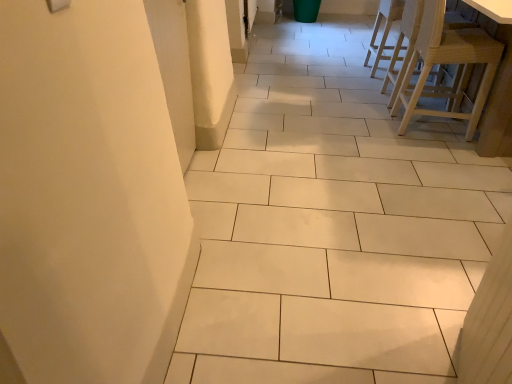
Question: Should I look upward or downward to see light wood stool at right, positioned as the third chair in back-to-front order?

Choices:
 (A) down
 (B) up

Answer: (B)

Question: Considering the relative sizes of natural wood chair at upper right, the 2th chair when ordered from back to front, and light wood stool at right, positioned as the third chair in back-to-front order, in the image provided, is natural wood chair at upper right, the 2th chair when ordered from back to front, wider than light wood stool at right, positioned as the third chair in back-to-front order,?

Choices:
 (A) no
 (B) yes

Answer: (B)

Question: Would you say natural wood chair at upper right, acting as the second chair starting from the front, contains light wood stool at right, which is the 1th chair from front to back?

Choices:
 (A) no
 (B) yes

Answer: (A)

Question: From the image's perspective, is natural wood chair at upper right, acting as the second chair starting from the front, below light wood stool at right, positioned as the third chair in back-to-front order?

Choices:
 (A) no
 (B) yes

Answer: (A)

Question: Does natural wood chair at upper right, the 2th chair when ordered from back to front, come in front of light wood stool at right, positioned as the third chair in back-to-front order?

Choices:
 (A) yes
 (B) no

Answer: (B)

Question: Can you confirm if natural wood chair at upper right, acting as the second chair starting from the front, is thinner than light wood stool at right, which is the 1th chair from front to back?

Choices:
 (A) yes
 (B) no

Answer: (B)

Question: Can you confirm if natural wood chair at upper right, acting as the second chair starting from the front, is shorter than light wood stool at right, positioned as the third chair in back-to-front order?

Choices:
 (A) no
 (B) yes

Answer: (B)

Question: From the image's perspective, is light wood chair at upper right, which is the first chair from back to front, on top of natural wood chair at upper right, acting as the second chair starting from the front?

Choices:
 (A) no
 (B) yes

Answer: (B)

Question: Can we say light wood chair at upper right, which is the first chair from back to front, lies outside natural wood chair at upper right, the 2th chair when ordered from back to front?

Choices:
 (A) no
 (B) yes

Answer: (B)

Question: Considering the relative sizes of light wood chair at upper right, marked as the 3th chair in a front-to-back arrangement, and natural wood chair at upper right, the 2th chair when ordered from back to front, in the image provided, is light wood chair at upper right, marked as the 3th chair in a front-to-back arrangement, taller than natural wood chair at upper right, the 2th chair when ordered from back to front,?

Choices:
 (A) no
 (B) yes

Answer: (A)

Question: Can natural wood chair at upper right, acting as the second chair starting from the front, be found inside light wood chair at upper right, which is the first chair from back to front?

Choices:
 (A) yes
 (B) no

Answer: (B)

Question: Does light wood chair at upper right, marked as the 3th chair in a front-to-back arrangement, have a smaller size compared to natural wood chair at upper right, the 2th chair when ordered from back to front?

Choices:
 (A) yes
 (B) no

Answer: (A)

Question: Is light wood chair at upper right, marked as the 3th chair in a front-to-back arrangement, to the left of natural wood chair at upper right, the 2th chair when ordered from back to front, from the viewer's perspective?

Choices:
 (A) no
 (B) yes

Answer: (B)

Question: Are light wood stool at right, which is the 1th chair from front to back, and natural wood chair at upper right, acting as the second chair starting from the front, located far from each other?

Choices:
 (A) yes
 (B) no

Answer: (B)